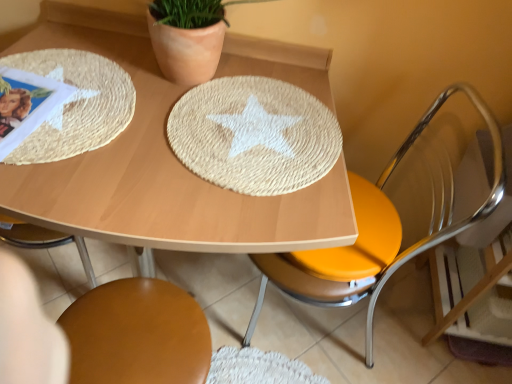
Question: Is the depth of raffia textured placemat at upper left greater than that of woven straw placemat at center?

Choices:
 (A) no
 (B) yes

Answer: (A)

Question: Is raffia textured placemat at upper left located outside woven straw placemat at center?

Choices:
 (A) yes
 (B) no

Answer: (A)

Question: From the image's perspective, is raffia textured placemat at upper left on woven straw placemat at center?

Choices:
 (A) yes
 (B) no

Answer: (A)

Question: From a real-world perspective, is raffia textured placemat at upper left over woven straw placemat at center?

Choices:
 (A) no
 (B) yes

Answer: (B)

Question: Considering the relative positions of raffia textured placemat at upper left and woven straw placemat at center in the image provided, is raffia textured placemat at upper left in front of woven straw placemat at center?

Choices:
 (A) no
 (B) yes

Answer: (B)

Question: Is raffia textured placemat at upper left shorter than woven straw placemat at center?

Choices:
 (A) no
 (B) yes

Answer: (B)

Question: Does woven straw placemat at center appear on the right side of metallic yellow seat at right, acting as the second chair starting from the left?

Choices:
 (A) no
 (B) yes

Answer: (A)

Question: Is woven straw placemat at center at the left side of metallic yellow seat at right, acting as the second chair starting from the left?

Choices:
 (A) yes
 (B) no

Answer: (A)

Question: Can you confirm if woven straw placemat at center is bigger than metallic yellow seat at right, which ranks as the first chair in right-to-left order?

Choices:
 (A) no
 (B) yes

Answer: (A)

Question: Does woven straw placemat at center have a lesser width compared to metallic yellow seat at right, acting as the second chair starting from the left?

Choices:
 (A) no
 (B) yes

Answer: (B)

Question: Considering the relative sizes of woven straw placemat at center and metallic yellow seat at right, acting as the second chair starting from the left, in the image provided, is woven straw placemat at center wider than metallic yellow seat at right, acting as the second chair starting from the left,?

Choices:
 (A) yes
 (B) no

Answer: (B)

Question: Are woven straw placemat at center and metallic yellow seat at right, acting as the second chair starting from the left, making contact?

Choices:
 (A) no
 (B) yes

Answer: (A)

Question: Does metallic yellow seat at right, which ranks as the first chair in right-to-left order, appear on the left side of raffia textured placemat at upper left?

Choices:
 (A) yes
 (B) no

Answer: (B)